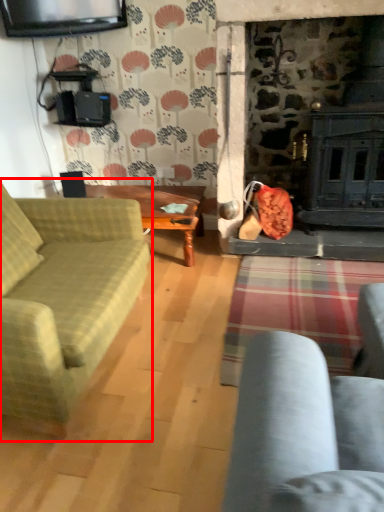
Question: In this image, where is studio couch (annotated by the red box) located relative to table?

Choices:
 (A) right
 (B) left

Answer: (B)